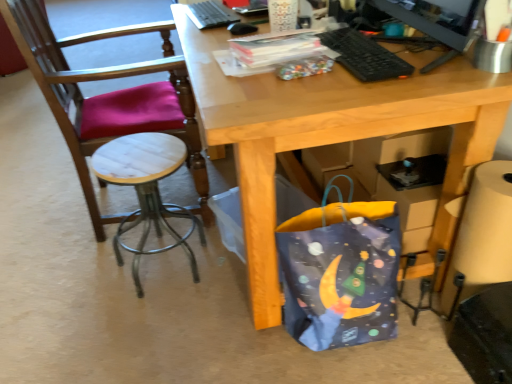
What are the coordinates of `vacant space that is in between wooden/marble stool at left and white marble stool at left` in the screenshot? It's located at (112, 263).